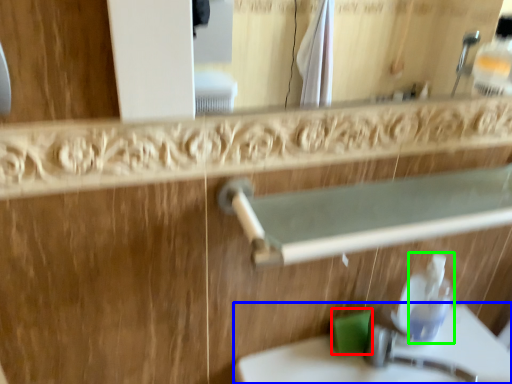
Question: Estimate the real-world distances between objects in this image. Which object is farther from soap (highlighted by a red box), sink (highlighted by a blue box) or soap dispenser (highlighted by a green box)?

Choices:
 (A) sink
 (B) soap dispenser

Answer: (A)